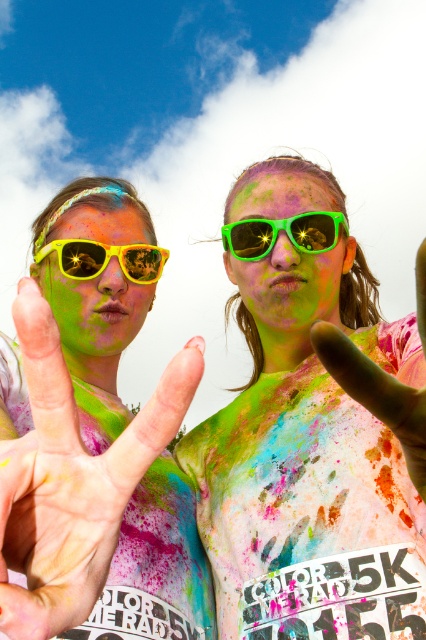
Looking at this image, you are organizing a photo shoot and need to ensure that the yellow reflective sunglasses at center and the green matte hand at center are clearly visible in the final image. Given their sizes, which object should you focus on first to ensure proper framing?

The yellow reflective sunglasses at center is bigger than the green matte hand at center, so focusing on the yellow reflective sunglasses at center first will ensure proper framing for both objects.

You are a photographer at the event and want to capture a closeup of the sunglasses and goggles. If the matte yellow sunglasses at left and green plastic goggles at center are both in your camera frame, which one will appear wider in the photo?

The matte yellow sunglasses at left will appear wider in the photo because its width surpasses that of the green plastic goggles at center.